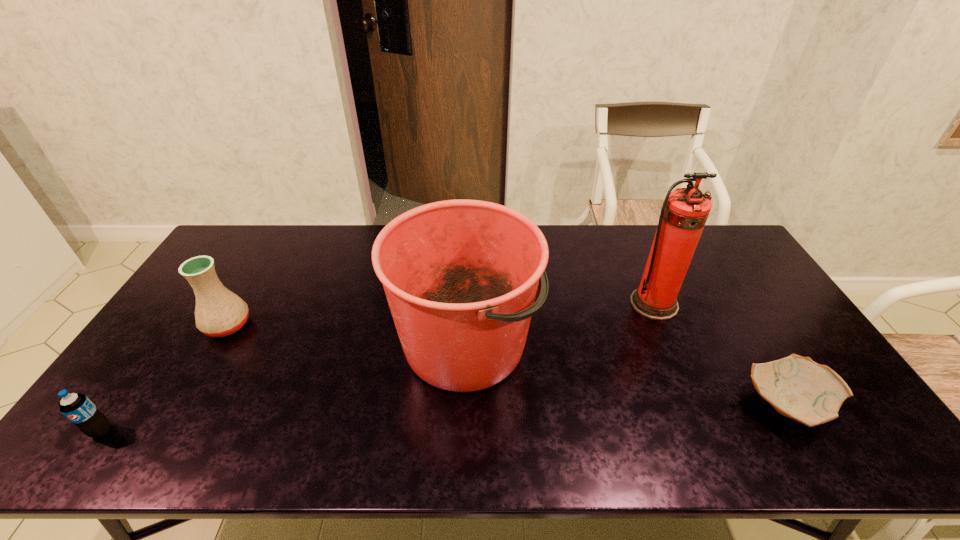
The height and width of the screenshot is (540, 960). I want to click on object at the near left corner, so click(x=78, y=408).

Identify the location of object at the near right corner. Image resolution: width=960 pixels, height=540 pixels. (797, 387).

Where is `free space at the far edge of the desktop`? free space at the far edge of the desktop is located at coordinates (598, 261).

In the image, there is a desktop. Where is `free space at the near edge`? This screenshot has height=540, width=960. free space at the near edge is located at coordinates (680, 453).

Identify the location of vacant position at the left edge of the desktop. The width and height of the screenshot is (960, 540). (194, 294).

The width and height of the screenshot is (960, 540). Identify the location of free space at the right edge. (768, 288).

The image size is (960, 540). Find the location of `vacant region at the far left corner of the desktop`. vacant region at the far left corner of the desktop is located at coordinates (241, 234).

Find the location of `vacant area at the far right corner`. vacant area at the far right corner is located at coordinates coord(703,235).

Find the location of a particular element. free area in between the right pottery and the leftmost object is located at coordinates (444, 418).

This screenshot has height=540, width=960. I want to click on free space between the third object from left to right and the fire extinguisher, so click(x=560, y=323).